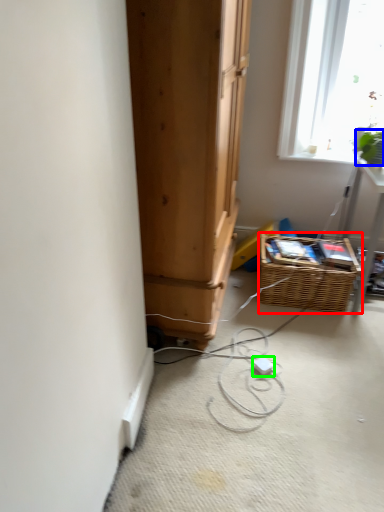
Question: Which object is the farthest from basket (highlighted by a red box)? Choose among these: plant (highlighted by a blue box) or extension cord (highlighted by a green box).

Choices:
 (A) plant
 (B) extension cord

Answer: (A)